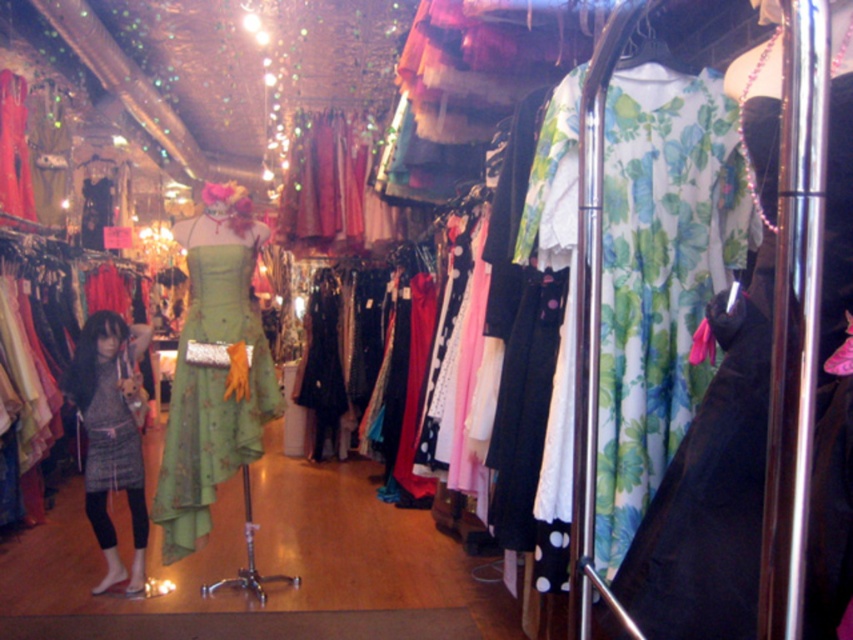
Based on the photo, you are a customer in the clothing store and want to know which of the two points, point (206, 506) or point (132, 410), is closer to you. Can you determine this based on the store layout?

Point (206, 506) is closer to the viewer than point (132, 410).

You are a customer in the store and want to see both the green floral fabric dress at right and the gray textured dress at center. Which dress should you look up to see first?

The green floral fabric dress at right is above the gray textured dress at center, so you should look up first to see the green floral fabric dress at right before looking down to see the gray textured dress at center.

You are standing in the clothing store and want to take a closer look at the point at coordinates [741,584]. Can you reach it if your maximum reach is 36 inches?

The point at coordinates [741,584] is 37.01 inches from the camera, which is slightly beyond your maximum reach of 36 inches. You might need to use a tool or step closer to reach it.